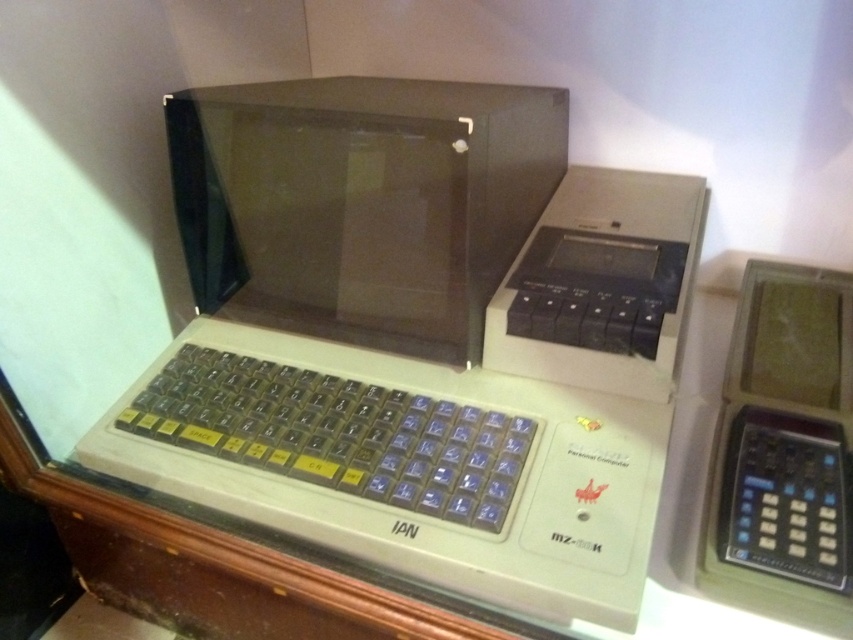
Question: Where is white plastic computer at center located in relation to black plastic calculator at right in the image?

Choices:
 (A) left
 (B) right

Answer: (A)

Question: Which object is closer to the camera taking this photo?

Choices:
 (A) green plastic calculator at right
 (B) clear plastic keyboard at center
 (C) white plastic computer at center

Answer: (C)

Question: Which object is farther from the camera taking this photo?

Choices:
 (A) black plastic calculator at right
 (B) clear plastic keyboard at center
 (C) white plastic computer at center
 (D) green plastic calculator at right

Answer: (B)

Question: Is clear plastic keyboard at center to the left of black plastic calculator at right from the viewer's perspective?

Choices:
 (A) no
 (B) yes

Answer: (B)

Question: Which of the following is the farthest from the observer?

Choices:
 (A) (724, 520)
 (B) (306, 369)
 (C) (776, 310)

Answer: (C)

Question: Does white plastic computer at center have a greater width compared to clear plastic keyboard at center?

Choices:
 (A) yes
 (B) no

Answer: (A)